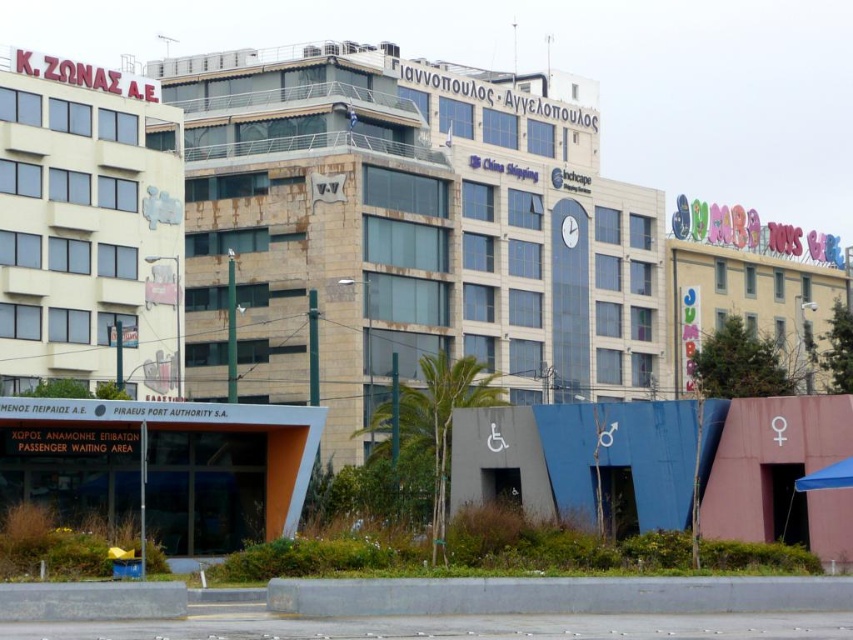
Can you confirm if rustic stone building at center is taller than beige concrete building at left?

Yes.

Does rustic stone building at center appear on the left side of beige concrete building at left?

In fact, rustic stone building at center is to the right of beige concrete building at left.

Find the location of a particular element. The height and width of the screenshot is (640, 853). rustic stone building at center is located at coordinates (408, 230).

Is rustic stone building at center positioned at the back of pastel painted building at right?

Yes.

Does rustic stone building at center have a greater height compared to pastel painted building at right?

Indeed, rustic stone building at center has a greater height compared to pastel painted building at right.

This screenshot has width=853, height=640. Identify the location of rustic stone building at center. (408, 230).

Is point (97, 164) positioned in front of point (677, 356)?

That is True.

Which is more to the right, beige concrete building at left or pastel painted building at right?

From the viewer's perspective, pastel painted building at right appears more on the right side.

Is point (62, 227) positioned before point (801, 284)?

That is True.

Locate an element on the screen. This screenshot has width=853, height=640. beige concrete building at left is located at coordinates (88, 228).